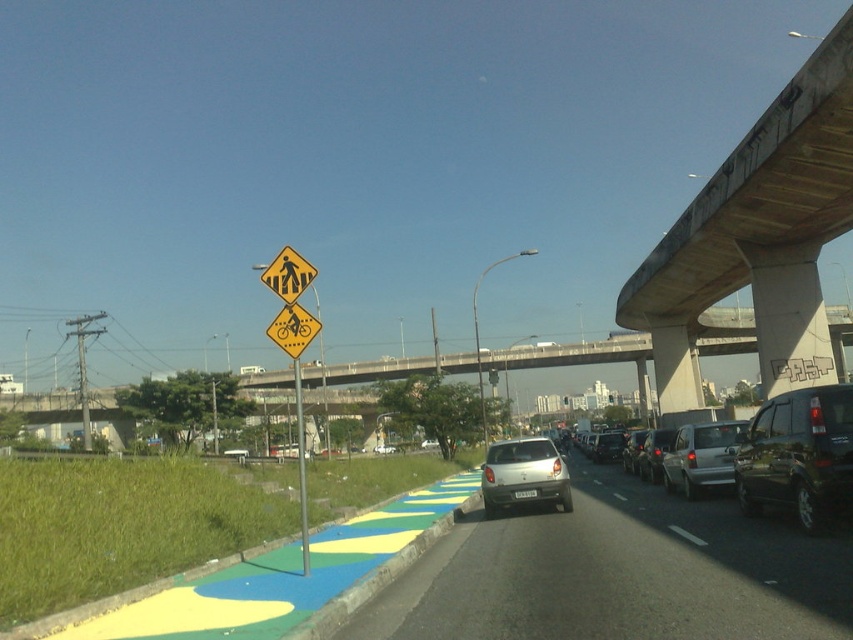
Who is positioned more to the right, shiny black suv at right or satin silver car at center?

From the viewer's perspective, shiny black suv at right appears more on the right side.

Is point (808, 467) positioned before point (498, 506)?

Yes, point (808, 467) is closer to viewer.

You are a GUI agent. You are given a task and a screenshot of the screen. Output one action in this format:
    pyautogui.click(x=<x>, y=<y>)
    Task: Click on the shiny black suv at right
    Image resolution: width=853 pixels, height=640 pixels.
    Given the screenshot: What is the action you would take?
    pyautogui.click(x=798, y=454)

In the scene shown: Measure the distance between point (x=718, y=476) and camera.

Point (x=718, y=476) is 15.60 meters away from camera.

Which of these two, silver metallic sedan at center-right or yellow plastic pedestrian crossing sign at upper center, stands shorter?

Standing shorter between the two is silver metallic sedan at center-right.

Consider the image. Who is more distant from viewer, (695, 449) or (293, 253)?

The point (695, 449) is behind.

This screenshot has height=640, width=853. Identify the location of silver metallic sedan at center-right. (701, 456).

Is silver metallic car at center below satin silver car at center?

Actually, silver metallic car at center is above satin silver car at center.

Between silver metallic car at center and satin silver car at center, which one has less height?

Standing shorter between the two is silver metallic car at center.

Find the location of a particular element. Image resolution: width=853 pixels, height=640 pixels. silver metallic car at center is located at coordinates (619, 573).

The width and height of the screenshot is (853, 640). In order to click on silver metallic car at center in this screenshot , I will do `click(619, 573)`.